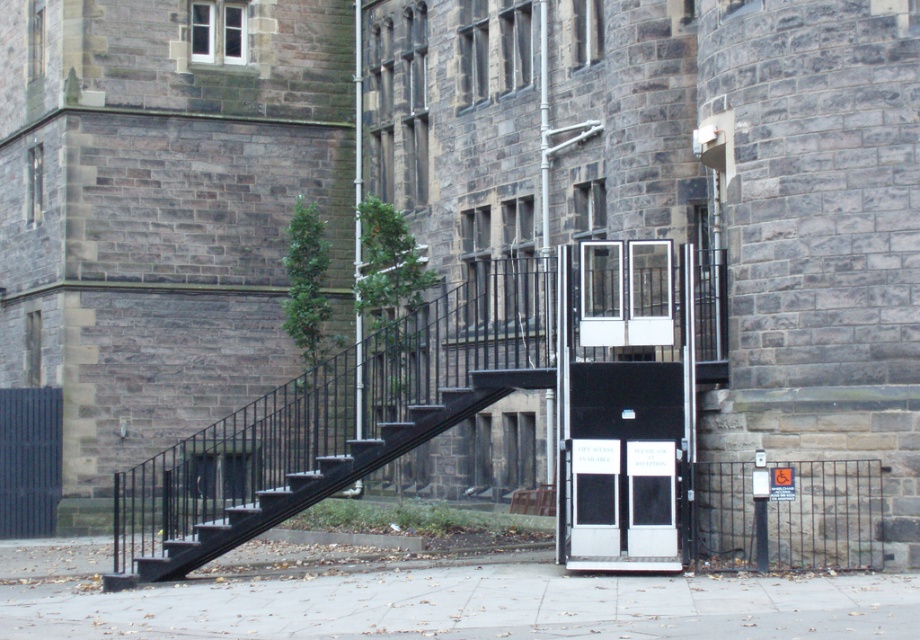
Does smooth concrete pavement at center appear over black matte door at center?

No, smooth concrete pavement at center is not above black matte door at center.

Is point (250, 588) in front of point (594, 508)?

No, (250, 588) is behind (594, 508).

Where is `smooth concrete pavement at center`? smooth concrete pavement at center is located at coordinates [472, 605].

Does dark gray stone tower at left have a larger size compared to black matte door at center?

Yes, dark gray stone tower at left is bigger than black matte door at center.

Does dark gray stone tower at left appear on the right side of black matte door at center?

In fact, dark gray stone tower at left is to the left of black matte door at center.

The width and height of the screenshot is (920, 640). I want to click on dark gray stone tower at left, so click(161, 211).

Does black matte door at center appear on the right side of black metal stairwell at lower left?

Indeed, black matte door at center is positioned on the right side of black metal stairwell at lower left.

Based on the photo, does black matte door at center come behind black metal stairwell at lower left?

No, it is not.

What do you see at coordinates (625, 461) in the screenshot? The width and height of the screenshot is (920, 640). I see `black matte door at center` at bounding box center [625, 461].

The height and width of the screenshot is (640, 920). Identify the location of black matte door at center. (625, 461).